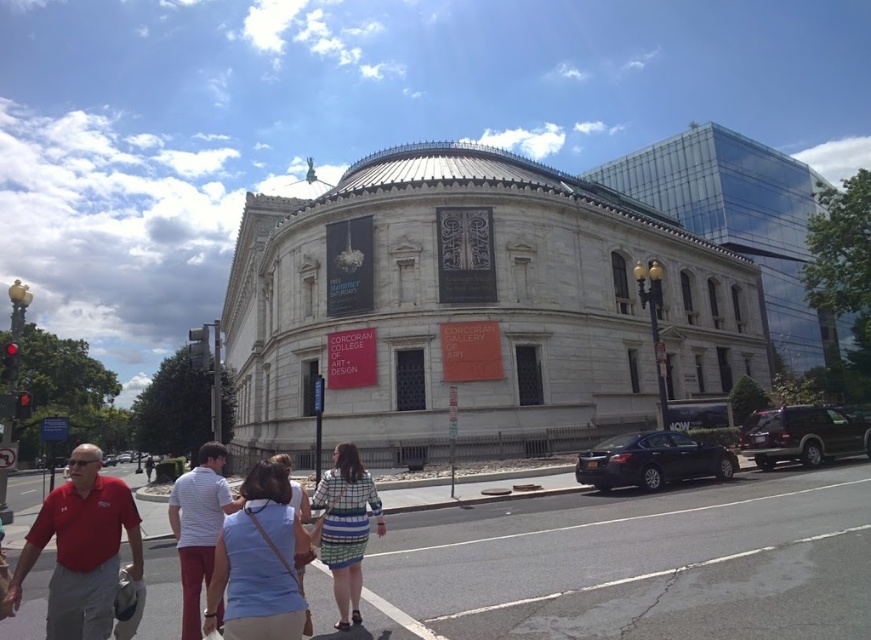
Question: Which point appears closest to the camera in this image?

Choices:
 (A) click(x=287, y=458)
 (B) click(x=579, y=452)
 (C) click(x=793, y=420)

Answer: (A)

Question: Which is nearer to the red cotton shirt at lower left?

Choices:
 (A) striped fabric dress at lower center
 (B) light blue denim shirt at center

Answer: (A)

Question: Does red cotton shirt at lower left have a greater width compared to white striped shirt at center?

Choices:
 (A) yes
 (B) no

Answer: (B)

Question: Can you confirm if red cotton shirt at lower left is positioned below striped fabric dress at lower center?

Choices:
 (A) yes
 (B) no

Answer: (A)

Question: Which object appears farthest from the camera in this image?

Choices:
 (A) shiny black sedan at lower right
 (B) red cotton shirt at lower left

Answer: (A)

Question: Is striped fabric dress at lower center bigger than striped fabric dress at center?

Choices:
 (A) yes
 (B) no

Answer: (B)